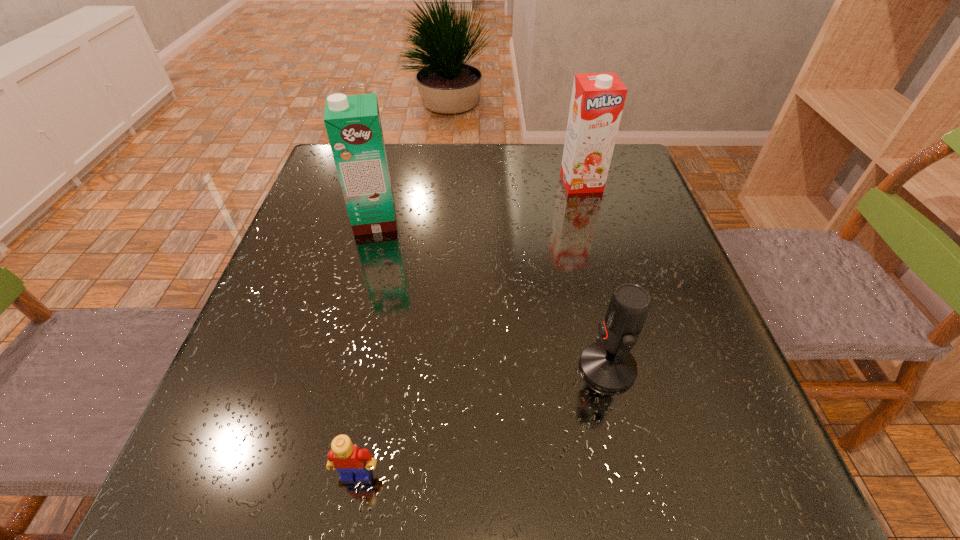
This screenshot has height=540, width=960. Identify the location of the second farthest object. (353, 124).

The width and height of the screenshot is (960, 540). In order to click on the left carton in this screenshot , I will do `click(353, 124)`.

Identify the location of the right carton. This screenshot has height=540, width=960. (597, 101).

This screenshot has height=540, width=960. I want to click on the farthest object, so point(597,101).

Image resolution: width=960 pixels, height=540 pixels. I want to click on the third farthest object, so click(x=608, y=365).

This screenshot has height=540, width=960. I want to click on microphone, so click(x=608, y=365).

The height and width of the screenshot is (540, 960). Find the location of `the nearest object`. the nearest object is located at coordinates (349, 460).

At what (x,y) coordinates should I click in order to perform the action: click on Lego. Please return your answer as a coordinate pair (x, y). Looking at the image, I should click on (349, 460).

Identify the location of free spot located on the front of the third nearest object. (342, 348).

You are a GUI agent. You are given a task and a screenshot of the screen. Output one action in this format:
    pyautogui.click(x=<x>, y=<y>)
    Task: Click on the vacant position located on the front of the farthest object
    The width and height of the screenshot is (960, 540).
    Given the screenshot: What is the action you would take?
    pyautogui.click(x=609, y=279)